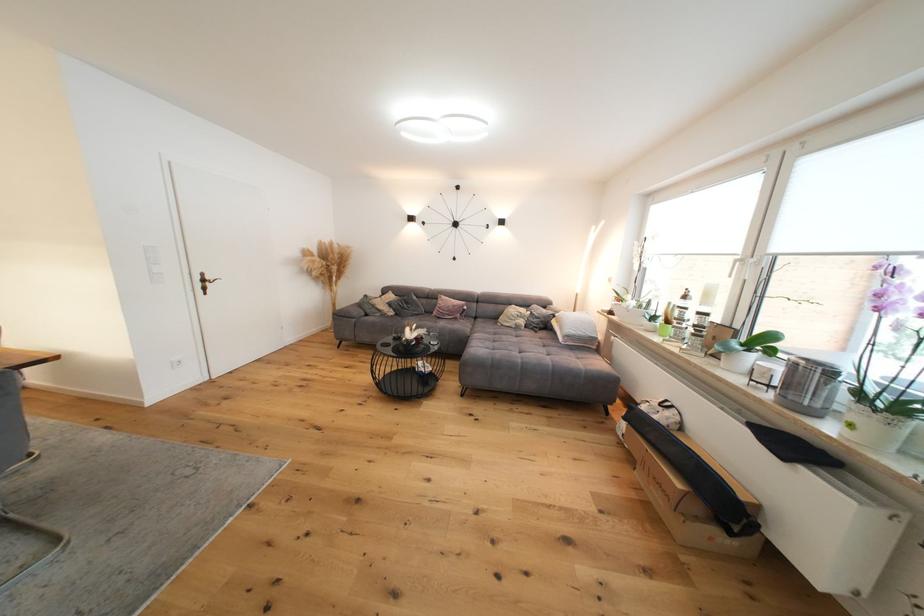
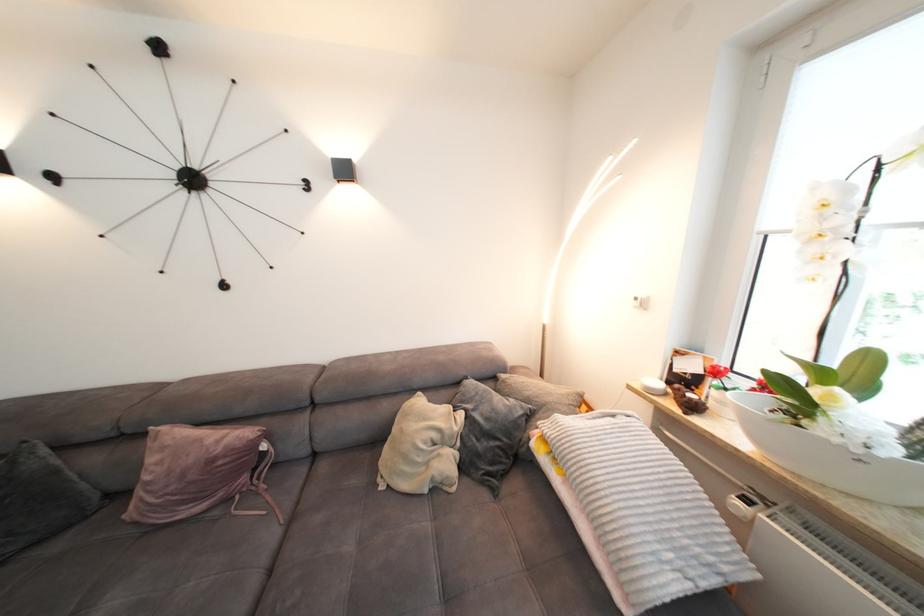
In the second image, find the point that corresponds to [487,321] in the first image.

(330, 469)